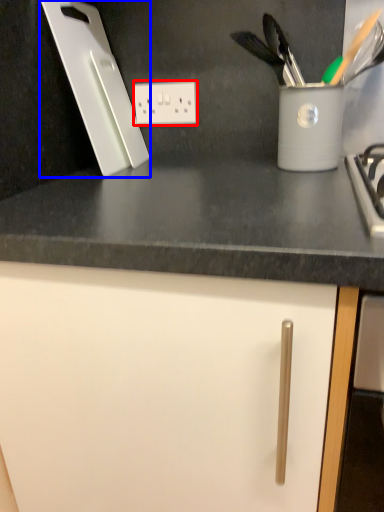
Question: Among these objects, which one is farthest to the camera, electric outlet (highlighted by a red box) or kitchen appliance (highlighted by a blue box)?

Choices:
 (A) electric outlet
 (B) kitchen appliance

Answer: (A)